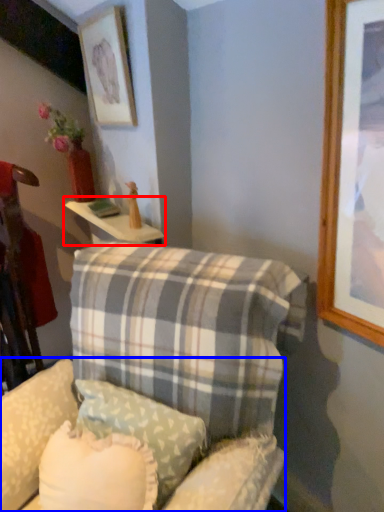
Question: Which object appears closest to the camera in this image, table (highlighted by a red box) or swivel chair (highlighted by a blue box)?

Choices:
 (A) table
 (B) swivel chair

Answer: (B)